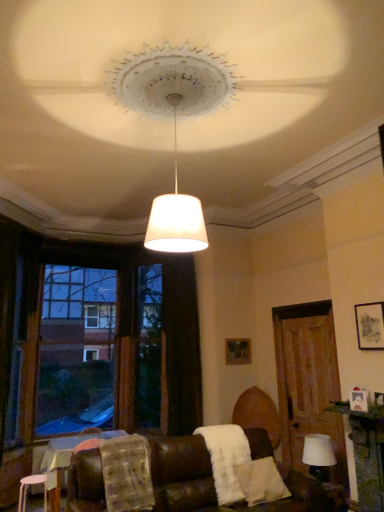
Describe the element at coordinates (68, 457) in the screenshot. I see `wooden textured table at lower left` at that location.

This screenshot has height=512, width=384. What do you see at coordinates (370, 325) in the screenshot?
I see `matte black picture frame at upper right, the 1th picture frame viewed from the top` at bounding box center [370, 325].

Describe the element at coordinates (27, 489) in the screenshot. This screenshot has width=384, height=512. I see `white matte stool at lower left` at that location.

What are the coordinates of `white fabric lampshade at lower right` in the screenshot? It's located at pos(319,456).

Is matte black picture frame at upper right, the second picture frame when ordered from back to front, in front of or behind white fabric lampshade at lower right in the image?

matte black picture frame at upper right, the second picture frame when ordered from back to front, is positioned closer to the viewer than white fabric lampshade at lower right.

Can white fabric lampshade at lower right be found inside matte black picture frame at upper right, the second picture frame when ordered from back to front?

That's incorrect, white fabric lampshade at lower right is not inside matte black picture frame at upper right, the second picture frame when ordered from back to front.

Which object is positioned more to the right, matte black picture frame at upper right, the 1th picture frame viewed from the top, or white fabric lampshade at lower right?

matte black picture frame at upper right, the 1th picture frame viewed from the top.

From a real-world perspective, who is located higher, matte black picture frame at upper right, the 1th picture frame viewed from the top, or white fabric lampshade at lower right?

matte black picture frame at upper right, the 1th picture frame viewed from the top.

Does white fabric lampshade at lower right have a greater width compared to wooden picture frame at center, which appears as the first picture frame when viewed from the back?

Indeed, white fabric lampshade at lower right has a greater width compared to wooden picture frame at center, which appears as the first picture frame when viewed from the back.

At what (x,y) coordinates should I click in order to perform the action: click on picture frame that is the 1st one when counting upward from the white fabric lampshade at lower right (from the image's perspective). Please return your answer as a coordinate pair (x, y). This screenshot has height=512, width=384. Looking at the image, I should click on (238, 351).

Would you say white fabric lampshade at lower right is to the left or to the right of wooden picture frame at center, placed as the 1th picture frame when sorted from bottom to top, in the picture?

In the image, white fabric lampshade at lower right appears on the right side of wooden picture frame at center, placed as the 1th picture frame when sorted from bottom to top.

From a real-world perspective, who is located higher, white fabric lampshade at lower right or wooden picture frame at center, acting as the second picture frame starting from the top?

From a 3D spatial view, wooden picture frame at center, acting as the second picture frame starting from the top, is above.

Is white fluffy blanket at lower center, which is the 2th blanket from left to right, inside or outside of wooden textured table at lower left?

A: white fluffy blanket at lower center, which is the 2th blanket from left to right, lies outside wooden textured table at lower left.

Is white fluffy blanket at lower center, which is the 2th blanket from left to right, facing away from wooden textured table at lower left?

No, white fluffy blanket at lower center, which is the 2th blanket from left to right,'s orientation is not away from wooden textured table at lower left.

In the scene shown: From the image's perspective, relative to wooden textured table at lower left, is white fluffy blanket at lower center, acting as the 1th blanket starting from the right, above or below?

white fluffy blanket at lower center, acting as the 1th blanket starting from the right, is situated higher than wooden textured table at lower left in the image.

Which is closer, (229, 433) or (116, 432)?

Point (229, 433) appears to be closer to the viewer than point (116, 432).

From a real-world perspective, is wooden textured table at lower left below white matte lampshade at center?

Yes, from a real-world perspective, wooden textured table at lower left is beneath white matte lampshade at center.

From the image's perspective, which one is positioned higher, wooden textured table at lower left or white matte lampshade at center?

white matte lampshade at center, from the image's perspective.

Based on their positions, is wooden textured table at lower left located to the left or right of white matte lampshade at center?

wooden textured table at lower left is to the left of white matte lampshade at center.

Considering the positions of point (44, 509) and point (172, 265), is point (44, 509) closer or farther from the camera than point (172, 265)?

Point (44, 509) appears to be closer to the viewer than point (172, 265).

Measure the distance between white matte stool at lower left and black velvet curtain at center.

8.50 feet.

Considering the sizes of objects white matte stool at lower left and black velvet curtain at center in the image provided, who is smaller, white matte stool at lower left or black velvet curtain at center?

white matte stool at lower left.

From a real-world perspective, is white matte stool at lower left physically below black velvet curtain at center?

Correct, in the physical world, white matte stool at lower left is lower than black velvet curtain at center.

Which object is wider, white matte stool at lower left or brown wooden window frame at left?

Wider between the two is brown wooden window frame at left.

In terms of size, does white matte stool at lower left appear bigger or smaller than brown wooden window frame at left?

In the image, white matte stool at lower left appears to be smaller than brown wooden window frame at left.

Looking at this image, does white matte stool at lower left touch brown wooden window frame at left?

white matte stool at lower left and brown wooden window frame at left are clearly separated.

From the image's perspective, is white matte stool at lower left positioned above or below brown wooden window frame at left?

Clearly, from the image's perspective, white matte stool at lower left is below brown wooden window frame at left.

Is matte black picture frame at upper right, which is the second picture frame in bottom-to-top order, situated inside wooden door at right or outside?

matte black picture frame at upper right, which is the second picture frame in bottom-to-top order, cannot be found inside wooden door at right.

Does matte black picture frame at upper right, the second picture frame when ordered from back to front, have a smaller size compared to wooden door at right?

Yes, matte black picture frame at upper right, the second picture frame when ordered from back to front, is smaller than wooden door at right.

Looking at this image, is matte black picture frame at upper right, the 1th picture frame viewed from the top, further to the viewer compared to wooden door at right?

No, matte black picture frame at upper right, the 1th picture frame viewed from the top, is closer to the viewer.

Can you confirm if matte black picture frame at upper right, arranged as the second picture frame when viewed from the left, is positioned to the left of wooden door at right?

No.

At what (x,y) coordinates should I click in order to perform the action: click on picture frame located in front of the white fabric lampshade at lower right. Please return your answer as a coordinate pair (x, y). The height and width of the screenshot is (512, 384). Looking at the image, I should click on (370, 325).

Locate an element on the screen. Image resolution: width=384 pixels, height=512 pixels. table lamp that appears below the wooden picture frame at center, placed as the 1th picture frame when sorted from bottom to top (from a real-world perspective) is located at coordinates (319, 456).

Estimate the real-world distances between objects in this image. Which object is further from wooden textured table at lower left, matte black picture frame at upper right, positioned as the first picture frame in front-to-back order, or black velvet curtain at center?

Based on the image, matte black picture frame at upper right, positioned as the first picture frame in front-to-back order, appears to be further to wooden textured table at lower left.

Considering their positions, is wooden textured table at lower left positioned closer to matte black picture frame at upper right, the 1th picture frame positioned from the right, than white fabric lampshade at lower right?

Among the two, white fabric lampshade at lower right is located nearer to matte black picture frame at upper right, the 1th picture frame positioned from the right.

Based on the photo, based on their spatial positions, is matte black picture frame at upper right, the second picture frame when ordered from back to front, or wooden door at right closer to white matte lampshade at center?

Based on the image, matte black picture frame at upper right, the second picture frame when ordered from back to front, appears to be nearer to white matte lampshade at center.

From the image, which object appears to be farther from matte black picture frame at upper right, the 1th picture frame viewed from the top, white matte lampshade at center or wooden picture frame at center, which appears as the first picture frame when viewed from the back?

Among the two, white matte lampshade at center is located further to matte black picture frame at upper right, the 1th picture frame viewed from the top.

Which object lies further to the anchor point matte black picture frame at upper right, the second picture frame when ordered from back to front, wooden picture frame at center, acting as the second picture frame starting from the top, or white fabric lampshade at lower right?

Among the two, wooden picture frame at center, acting as the second picture frame starting from the top, is located further to matte black picture frame at upper right, the second picture frame when ordered from back to front.

When comparing their distances from white fluffy blanket at lower center, which is the 2th blanket from left to right, does black velvet curtain at center or white matte lampshade at center seem further?

white matte lampshade at center is further to white fluffy blanket at lower center, which is the 2th blanket from left to right.

Looking at the image, which one is located closer to white matte lampshade at center, white fabric lampshade at lower right or white matte stool at lower left?

Among the two, white matte stool at lower left is located nearer to white matte lampshade at center.

Estimate the real-world distances between objects in this image. Which object is closer to white matte lampshade at center, white fluffy blanket at lower center, which is the 2th blanket from left to right, or wooden textured table at lower left?

white fluffy blanket at lower center, which is the 2th blanket from left to right, is positioned closer to the anchor white matte lampshade at center.

The height and width of the screenshot is (512, 384). Find the location of `curtain between white matte lampshade at center and wooden picture frame at center, which appears as the first picture frame when viewed from the back, from front to back`. curtain between white matte lampshade at center and wooden picture frame at center, which appears as the first picture frame when viewed from the back, from front to back is located at coordinates (181, 345).

At what (x,y) coordinates should I click in order to perform the action: click on table lamp located between white fluffy pillow at lower right and black velvet curtain at center in the depth direction. Please return your answer as a coordinate pair (x, y). Looking at the image, I should click on click(x=319, y=456).

Where is `blanket located between woven beige blanket at lower left, which is the first blanket from left to right, and wooden door at right in the left-right direction`? blanket located between woven beige blanket at lower left, which is the first blanket from left to right, and wooden door at right in the left-right direction is located at coordinates (226, 459).

Locate an element on the screen. Image resolution: width=384 pixels, height=512 pixels. glass door between white matte lampshade at center and white fabric lampshade at lower right in the vertical direction is located at coordinates (308, 381).